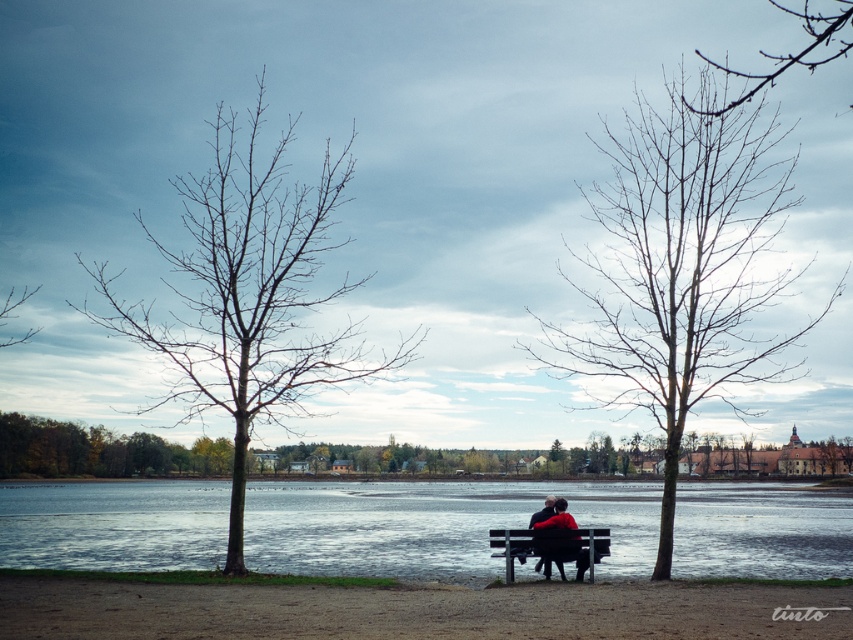
Looking at this image, is bare wood tree at center bigger than bare branches at upper right?

Yes, bare wood tree at center is bigger than bare branches at upper right.

Does point (784, 211) come closer to viewer compared to point (811, 58)?

Yes, point (784, 211) is closer to viewer.

Locate an element on the screen. Image resolution: width=853 pixels, height=640 pixels. bare wood tree at center is located at coordinates coord(683,264).

Does point (357, 515) come in front of point (561, 552)?

No, it is behind (561, 552).

Which of these two, smooth water at center or black leather jacket at center, stands shorter?

Standing shorter between the two is black leather jacket at center.

Between point (573, 490) and point (560, 554), which one is positioned behind?

The point (573, 490) is behind.

Where is `smooth water at center`? This screenshot has height=640, width=853. smooth water at center is located at coordinates (432, 525).

How far apart are bare branches at upper right and wooden bench at center?

They are 38.10 feet apart.

Measure the distance from bare branches at upper right to wooden bench at center.

bare branches at upper right is 11.61 meters away from wooden bench at center.

Is point (809, 17) positioned before point (548, 541)?

No, (809, 17) is behind (548, 541).

Find the location of `bare branches at upper right`. bare branches at upper right is located at coordinates (798, 51).